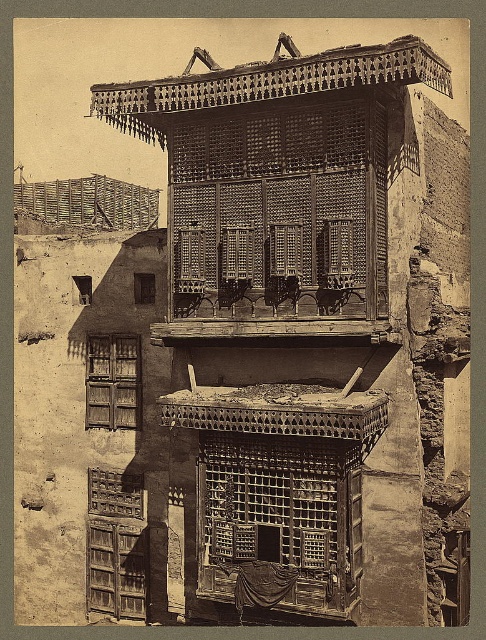
Question: Is rustic wood balcony at upper center above rustic wooden lattice at center?

Choices:
 (A) yes
 (B) no

Answer: (B)

Question: From the image, what is the correct spatial relationship of rustic wood balcony at upper center in relation to rustic wooden lattice at center?

Choices:
 (A) left
 (B) right

Answer: (A)

Question: Does rustic wood balcony at upper center have a lesser width compared to rustic wooden lattice at center?

Choices:
 (A) yes
 (B) no

Answer: (B)